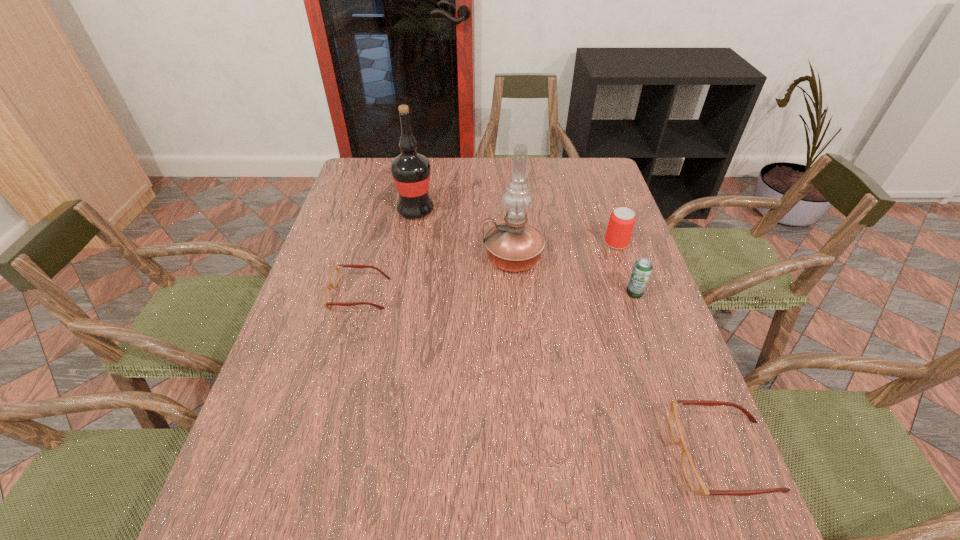
This screenshot has height=540, width=960. What are the coordinates of `location for an additional spectacles to make spacing equal` in the screenshot? It's located at (513, 362).